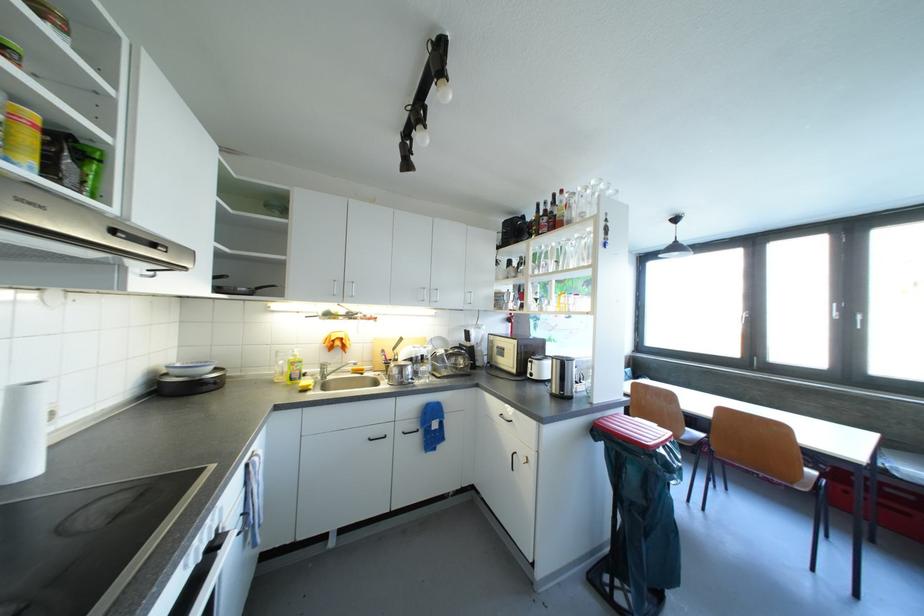
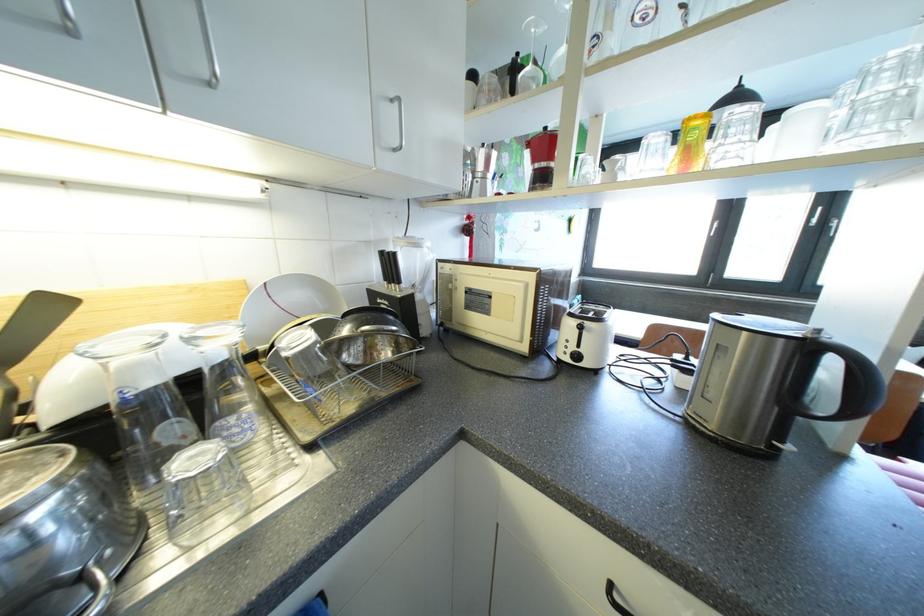
Find the pixel in the second image that matches point 470,333 in the first image.

(387, 256)